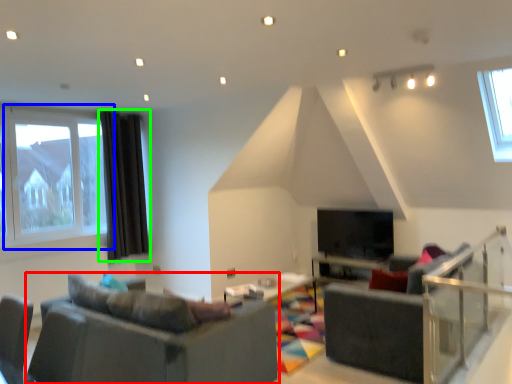
Question: Which object is positioned closest to studio couch (highlighted by a red box)? Select from window (highlighted by a blue box) and curtain (highlighted by a green box).

Choices:
 (A) window
 (B) curtain

Answer: (A)